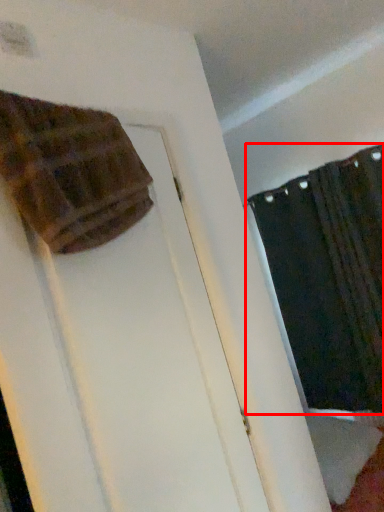
Question: From the image's perspective, what is the correct spatial relationship of curtain (annotated by the red box) in relation to blanket?

Choices:
 (A) above
 (B) below

Answer: (B)